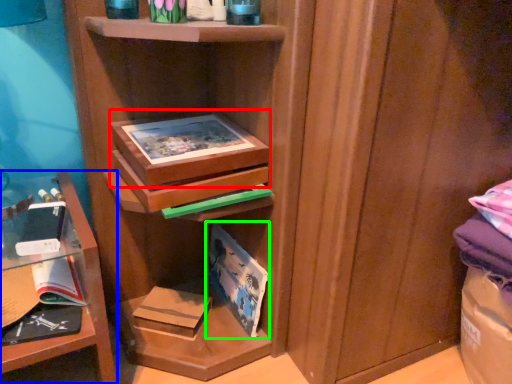
Question: Based on their relative distances, which object is nearer to box (highlighted by a red box)? Choose from shelf (highlighted by a blue box) and paperback book (highlighted by a green box).

Choices:
 (A) shelf
 (B) paperback book

Answer: (A)